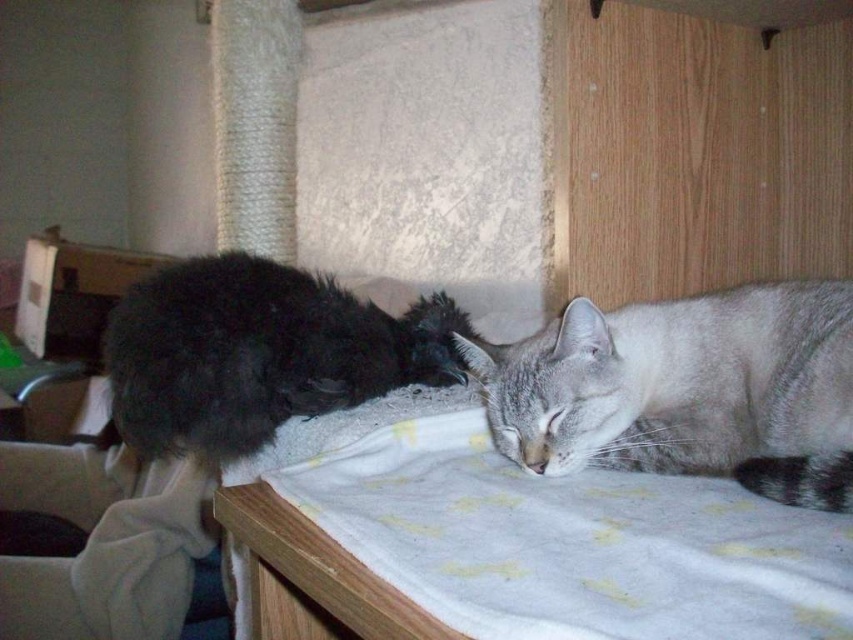
Question: Which point is closer to the camera taking this photo?

Choices:
 (A) (753, 538)
 (B) (321, 310)
 (C) (834, 353)

Answer: (A)

Question: Is white soft blanket at center to the left of fluffy black cat at left from the viewer's perspective?

Choices:
 (A) yes
 (B) no

Answer: (B)

Question: Among these points, which one is farthest from the camera?

Choices:
 (A) (790, 353)
 (B) (724, 518)

Answer: (A)

Question: Can you confirm if gray fur cat at center is positioned to the right of fluffy black cat at left?

Choices:
 (A) yes
 (B) no

Answer: (A)

Question: Which object appears farthest from the camera in this image?

Choices:
 (A) fluffy black cat at left
 (B) gray fur cat at center

Answer: (A)

Question: Does white soft blanket at center appear on the right side of fluffy black cat at left?

Choices:
 (A) yes
 (B) no

Answer: (A)